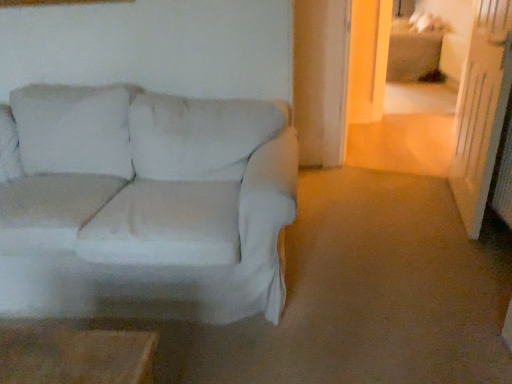
Question: Is transparent glass door at right wider or thinner than white fabric couch at left?

Choices:
 (A) wide
 (B) thin

Answer: (B)

Question: Is transparent glass door at right in front of or behind white fabric couch at left in the image?

Choices:
 (A) front
 (B) behind

Answer: (B)

Question: Considering the positions of point (484, 66) and point (88, 92), is point (484, 66) closer or farther from the camera than point (88, 92)?

Choices:
 (A) farther
 (B) closer

Answer: (A)

Question: From a real-world perspective, is white fabric couch at left physically located above or below transparent glass door at right?

Choices:
 (A) above
 (B) below

Answer: (B)

Question: From their relative heights in the image, would you say white fabric couch at left is taller or shorter than transparent glass door at right?

Choices:
 (A) short
 (B) tall

Answer: (A)

Question: Is white fabric couch at left in front of or behind transparent glass door at right in the image?

Choices:
 (A) front
 (B) behind

Answer: (A)

Question: Would you say white fabric couch at left is to the left or to the right of transparent glass door at right in the picture?

Choices:
 (A) right
 (B) left

Answer: (B)